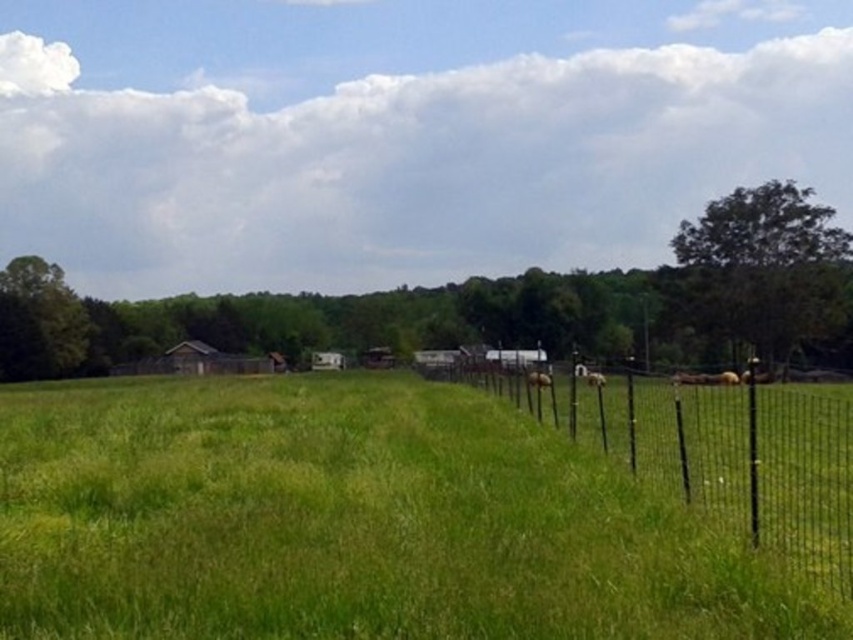
Measure the distance between black wire fence at right and camera.

A distance of 17.83 feet exists between black wire fence at right and camera.

What do you see at coordinates (712, 451) in the screenshot?
I see `black wire fence at right` at bounding box center [712, 451].

Identify the location of black wire fence at right. (712, 451).

From the picture: Which is more to the right, green grassy field at center or black wire fence at right?

black wire fence at right

Does green grassy field at center appear on the left side of black wire fence at right?

Indeed, green grassy field at center is positioned on the left side of black wire fence at right.

Locate an element on the screen. Image resolution: width=853 pixels, height=640 pixels. green grassy field at center is located at coordinates (351, 520).

Describe the element at coordinates (351, 520) in the screenshot. This screenshot has height=640, width=853. I see `green grassy field at center` at that location.

Is green grassy field at center above brown furry dog at center?

No, green grassy field at center is not above brown furry dog at center.

Who is more forward, (22, 483) or (548, 376)?

Point (22, 483) is more forward.

Find the location of a particular element. The height and width of the screenshot is (640, 853). green grassy field at center is located at coordinates (351, 520).